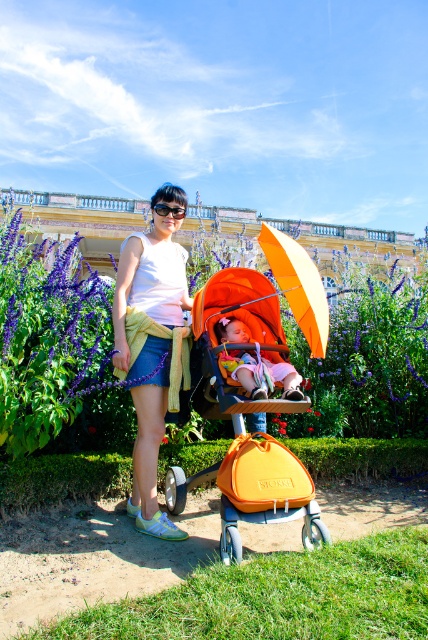
Based on the photo, can you confirm if orange matte baby carriage at center is thinner than orange fabric stroller at center?

In fact, orange matte baby carriage at center might be wider than orange fabric stroller at center.

Does orange matte baby carriage at center have a smaller size compared to orange fabric stroller at center?

No.

Does point (243, 273) come in front of point (264, 362)?

No, (243, 273) is behind (264, 362).

I want to click on orange matte baby carriage at center, so click(x=243, y=410).

Does purple matte flower at upper left have a smaller size compared to denim skirt at center?

Actually, purple matte flower at upper left might be larger than denim skirt at center.

The image size is (428, 640). I want to click on purple matte flower at upper left, so click(x=368, y=356).

Based on the photo, does purple matte flower at upper left appear on the right side of orange fabric stroller at center?

No, purple matte flower at upper left is not to the right of orange fabric stroller at center.

Between purple matte flower at upper left and orange fabric stroller at center, which one is positioned higher?

purple matte flower at upper left is above.

Between point (332, 410) and point (240, 378), which one is positioned behind?

Positioned behind is point (332, 410).

Image resolution: width=428 pixels, height=640 pixels. Find the location of `purple matte flower at upper left`. purple matte flower at upper left is located at coordinates (368, 356).